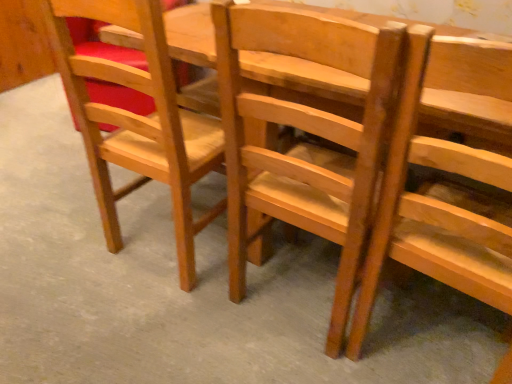
Identify the location of vacant area that is in front of matte wood chair at left, which is the third chair in right-to-left order. Image resolution: width=512 pixels, height=384 pixels. (141, 324).